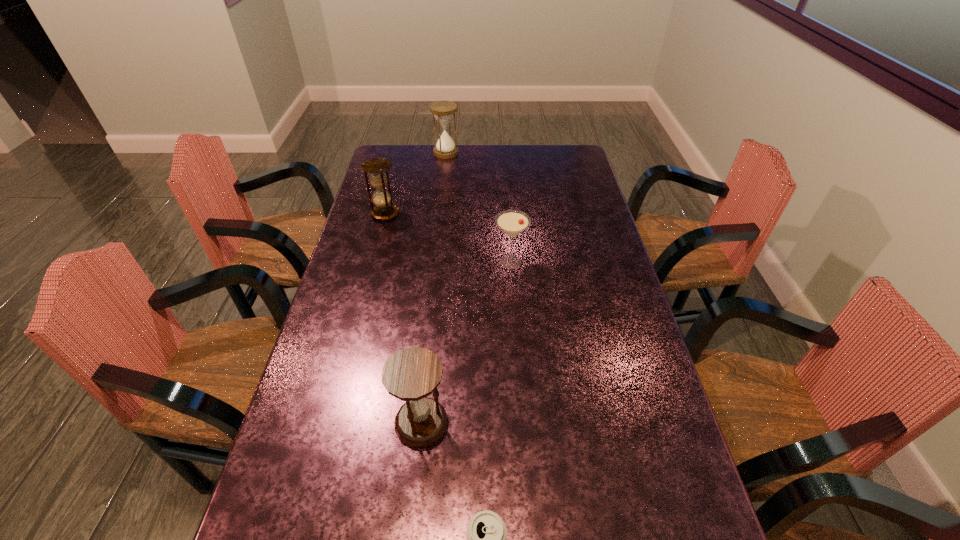
This screenshot has height=540, width=960. Find the location of `the farthest hourglass`. the farthest hourglass is located at coordinates (443, 111).

What are the coordinates of `the second nearest hourglass` in the screenshot? It's located at (376, 167).

Find the location of a particular element. This screenshot has height=540, width=960. the leftmost hourglass is located at coordinates (376, 167).

In order to click on the fourth farthest object in this screenshot , I will do `click(411, 374)`.

You are a GUI agent. You are given a task and a screenshot of the screen. Output one action in this format:
    pyautogui.click(x=<x>, y=<y>)
    Task: Click on the fourth tallest object
    Image resolution: width=960 pixels, height=540 pixels.
    Given the screenshot: What is the action you would take?
    pyautogui.click(x=512, y=222)

You are a GUI agent. You are given a task and a screenshot of the screen. Output one action in this format:
    pyautogui.click(x=<x>, y=<y>)
    Task: Click on the third nearest object
    
    Given the screenshot: What is the action you would take?
    pyautogui.click(x=512, y=222)

At what (x,y) coordinates should I click in order to perform the action: click on vacant area located 0.150m on the front of the farthest object. Please return your answer as a coordinate pair (x, y). The height and width of the screenshot is (540, 960). Looking at the image, I should click on 444,177.

Locate an element on the screen. vacant space located on the right of the leftmost hourglass is located at coordinates (478, 214).

Identify the location of vacant space situated on the back of the second nearest object. (432, 323).

Where is `vacant space situated on the left of the second shortest object`? The height and width of the screenshot is (540, 960). vacant space situated on the left of the second shortest object is located at coordinates (414, 262).